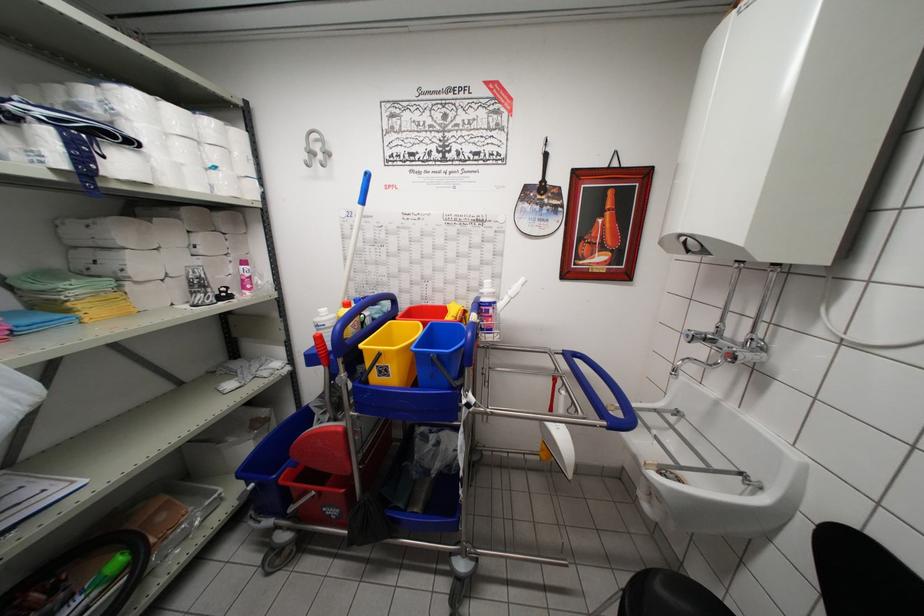
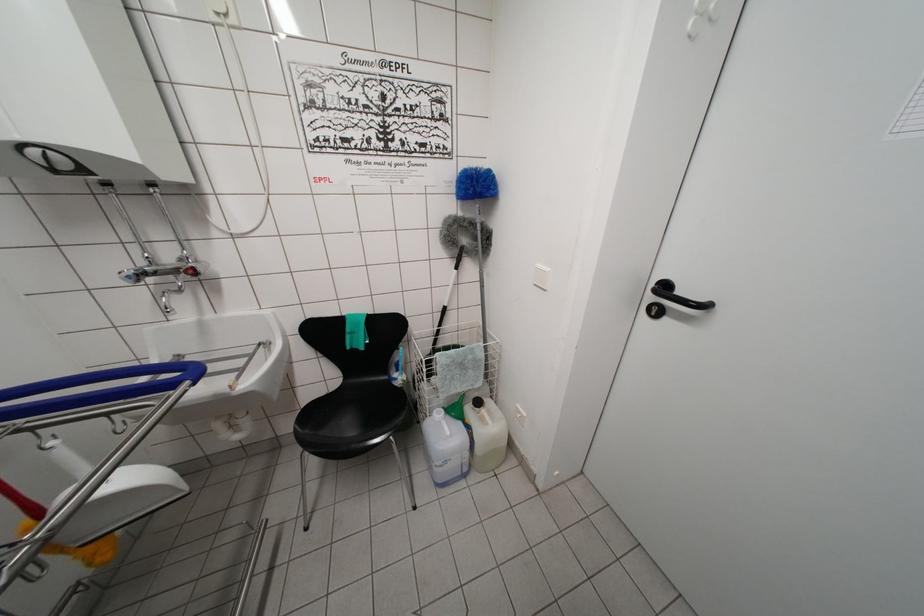
In the second image, find the point that corresponds to the point at 690,339 in the first image.

(131, 282)